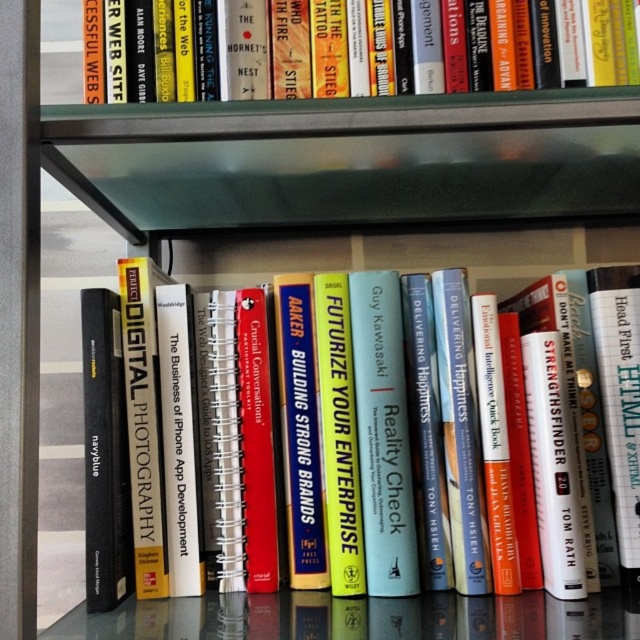
Can you confirm if hardcover book at center is positioned below hardcover book at upper center?

Yes.

Between hardcover book at center and hardcover book at upper center, which one appears on the left side from the viewer's perspective?

From the viewer's perspective, hardcover book at upper center appears more on the left side.

Is point (460, 432) farther from viewer compared to point (451, 76)?

That is True.

Identify the location of hardcover book at center. (490, 433).

Who is higher up, hardcover book at upper center or transparent glass table at lower center?

hardcover book at upper center is higher up.

Looking at this image, which is below, hardcover book at upper center or transparent glass table at lower center?

transparent glass table at lower center is below.

Does point (227, 29) come behind point (452, 611)?

Yes, it is behind point (452, 611).

You are a GUI agent. You are given a task and a screenshot of the screen. Output one action in this format:
    pyautogui.click(x=<x>, y=<y>)
    Task: Click on the hardcover book at upper center
    Image resolution: width=640 pixels, height=640 pixels.
    Given the screenshot: What is the action you would take?
    pyautogui.click(x=346, y=48)

Can you confirm if hardcover book at center is positioned below transparent glass table at lower center?

No.

Can you confirm if hardcover book at center is taller than transparent glass table at lower center?

Yes, hardcover book at center is taller than transparent glass table at lower center.

Image resolution: width=640 pixels, height=640 pixels. I want to click on hardcover book at center, so click(490, 433).

Identify the location of hardcover book at center. The image size is (640, 640). (490, 433).